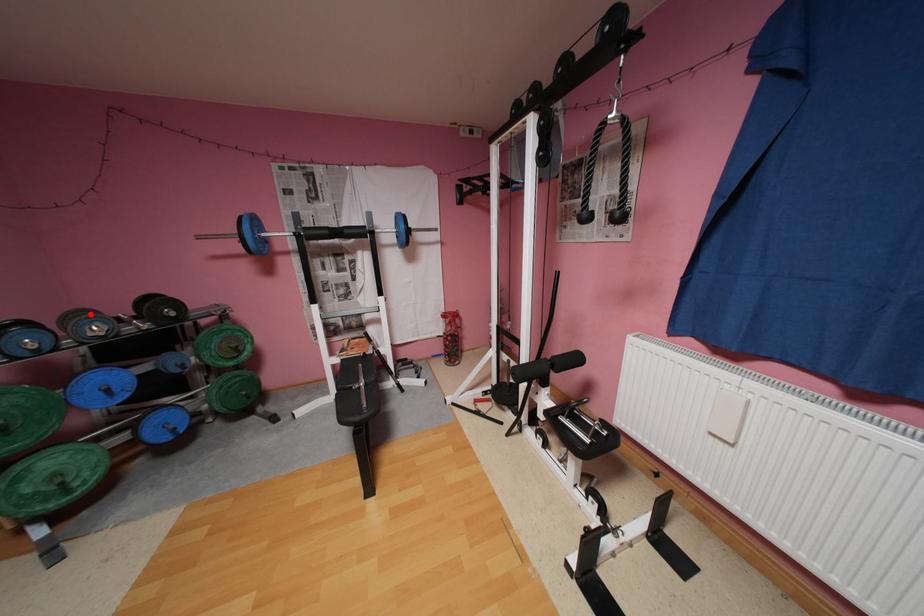
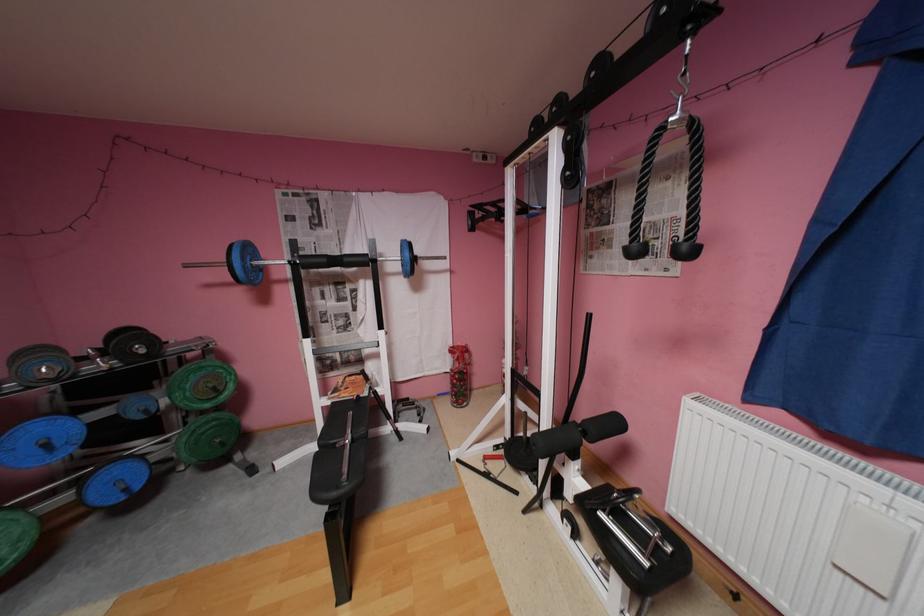
In the second image, find the point that corresponds to the highlighted location in the first image.

(49, 351)